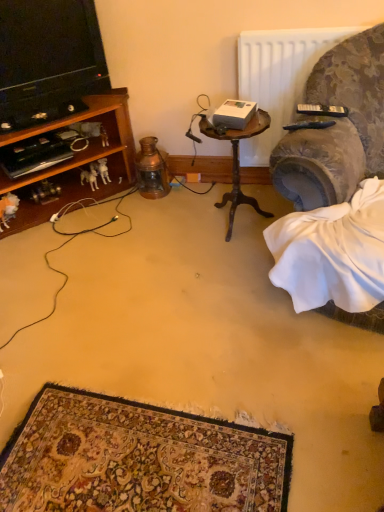
Find the location of a particular element. vacant area situated below wooden table at center (from a real-world perspective) is located at coordinates (233, 224).